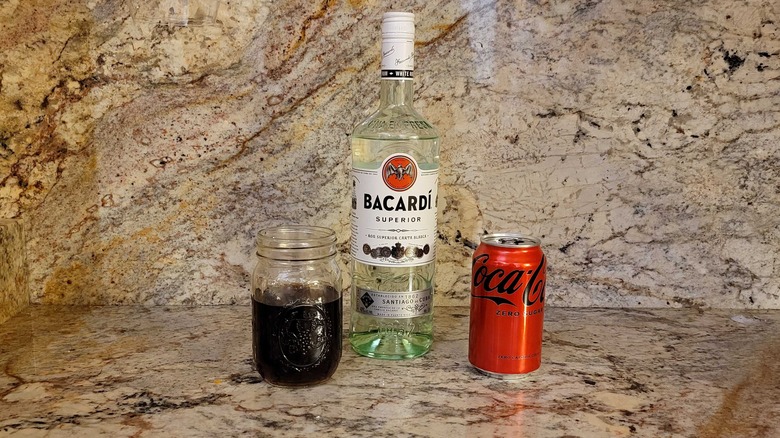
At what (x,y) coordinates should I click in order to perform the action: click on wall. Please return your answer as a coordinate pair (x, y). Looking at the image, I should click on (675, 96).